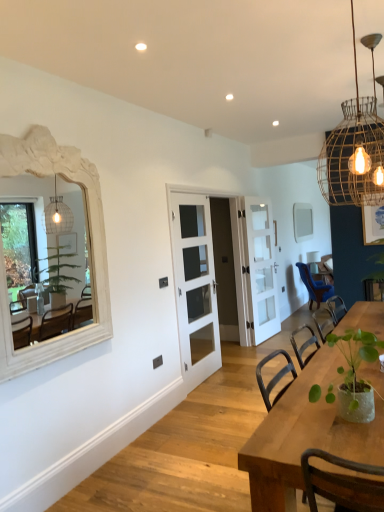
Question: From a real-world perspective, is green matte plant at lower right physically below white glossy door at center, placed as the third door when sorted from front to back?

Choices:
 (A) no
 (B) yes

Answer: (B)

Question: Is the position of green matte plant at lower right less distant than that of white glossy door at center, which appears as the first door when viewed from the back?

Choices:
 (A) yes
 (B) no

Answer: (A)

Question: Considering the relative sizes of green matte plant at lower right and white glossy door at center, which appears as the first door when viewed from the back, in the image provided, is green matte plant at lower right thinner than white glossy door at center, which appears as the first door when viewed from the back,?

Choices:
 (A) no
 (B) yes

Answer: (A)

Question: From the image's perspective, is green matte plant at lower right below white glossy door at center, placed as the third door when sorted from front to back?

Choices:
 (A) no
 (B) yes

Answer: (B)

Question: Can you confirm if green matte plant at lower right is taller than white glossy door at center, which appears as the first door when viewed from the back?

Choices:
 (A) no
 (B) yes

Answer: (A)

Question: From the image's perspective, does green matte plant at lower right appear higher than white glossy door at center, placed as the third door when sorted from front to back?

Choices:
 (A) yes
 (B) no

Answer: (B)

Question: Is white glass door at center, the 2th door viewed from the front, in front of white glass door at center, the first door positioned from the front?

Choices:
 (A) no
 (B) yes

Answer: (A)

Question: From a real-world perspective, is white glass door at center, the second door positioned from the back, on white glass door at center, the 3th door positioned from the back?

Choices:
 (A) yes
 (B) no

Answer: (B)

Question: Is white glass door at center, the second door positioned from the back, oriented towards white glass door at center, the first door positioned from the front?

Choices:
 (A) yes
 (B) no

Answer: (A)

Question: Can you confirm if white glass door at center, the second door positioned from the back, is taller than white glass door at center, the 3th door positioned from the back?

Choices:
 (A) yes
 (B) no

Answer: (B)

Question: Does white glass door at center, the second door positioned from the back, have a lesser height compared to white glass door at center, the 3th door positioned from the back?

Choices:
 (A) yes
 (B) no

Answer: (A)

Question: Is white glass door at center, the second door positioned from the back, positioned with its back to white glass door at center, the 3th door positioned from the back?

Choices:
 (A) yes
 (B) no

Answer: (A)

Question: Is white carved wood mirror at left, which ranks as the 2th mirror in back-to-front order, smaller than wooden table at center?

Choices:
 (A) no
 (B) yes

Answer: (B)